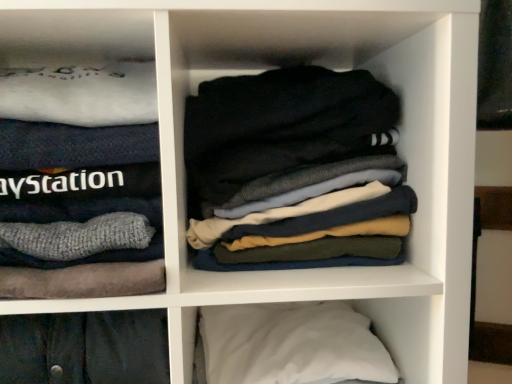
Question: Is dark gray cotton socks at center bigger or smaller than white soft pillow at lower right?

Choices:
 (A) big
 (B) small

Answer: (A)

Question: From a real-world perspective, relative to white soft pillow at lower right, is dark gray cotton socks at center vertically above or below?

Choices:
 (A) above
 (B) below

Answer: (A)

Question: Based on their relative distances, which object is farther from the white soft sweater at left?

Choices:
 (A) dark gray cotton socks at center
 (B) white soft pillow at lower right

Answer: (B)

Question: Which of these objects is positioned closest to the white soft pillow at lower right?

Choices:
 (A) white soft sweater at left
 (B) dark gray cotton socks at center

Answer: (B)